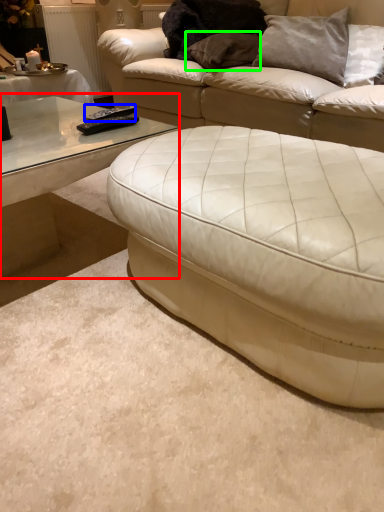
Question: Which object is positioned farthest from coffee table (highlighted by a red box)? Select from remote (highlighted by a blue box) and pillow (highlighted by a green box).

Choices:
 (A) remote
 (B) pillow

Answer: (B)